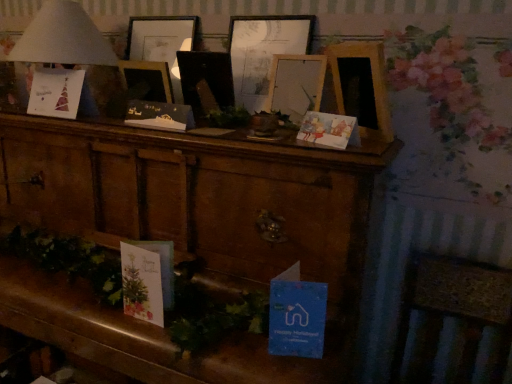
Question: From the image's perspective, is wooden picture frame at center, which ranks as the 3th picture frame in right-to-left order, positioned above or below wooden cabinet at center?

Choices:
 (A) above
 (B) below

Answer: (A)

Question: In the image, is wooden picture frame at center, placed as the 1th picture frame when sorted from left to right, positioned in front of or behind wooden cabinet at center?

Choices:
 (A) front
 (B) behind

Answer: (B)

Question: Which object is the closest to the wooden cabinet at center?

Choices:
 (A) wooden picture frame at center, which is counted as the 2th picture frame, starting from the right
 (B) matte paper card at upper left, which is the first christmas card in left-to-right order
 (C) white paper lampshade at upper left
 (D) wooden picture frame at center, placed as the 1th picture frame when sorted from left to right
 (E) matte paper card at center right, placed as the third christmas card when sorted from left to right

Answer: (B)

Question: Based on their relative distances, which object is farther from the matte paper card at upper left, which is the first christmas card in left-to-right order?

Choices:
 (A) wooden picture frame at center, which is counted as the 2th picture frame, starting from the right
 (B) wooden picture frame at center, which is counted as the 3th picture frame, starting from the left
 (C) matte black card at center, arranged as the second christmas card when viewed from the left
 (D) matte paper card at center right, the 1th christmas card when ordered from right to left
 (E) wooden picture frame at center, placed as the 1th picture frame when sorted from left to right

Answer: (D)